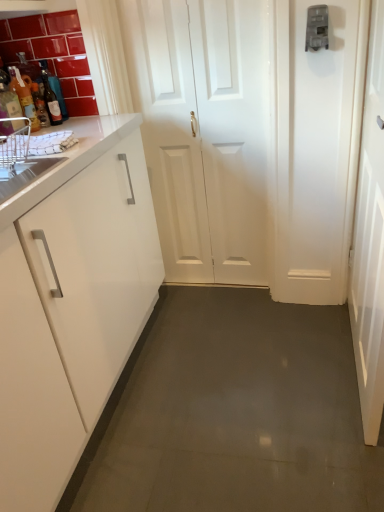
Question: In terms of height, does white glossy door at center, acting as the 2th door starting from the right, look taller or shorter compared to white glossy sink at left?

Choices:
 (A) tall
 (B) short

Answer: (A)

Question: Is white glossy door at center, which is the 1th door in left-to-right order, wider or thinner than white glossy sink at left?

Choices:
 (A) wide
 (B) thin

Answer: (B)

Question: Which is farther from the matte glass bottle at left, the 1th bottle viewed from the right?

Choices:
 (A) translucent glass bottle at left, the 3th bottle from the right
 (B) white glossy door at center, acting as the 2th door starting from the right
 (C) white glossy sink at left
 (D) white glossy door at right, the second door from the left
 (E) translucent glass bottle at left, the second bottle viewed from the left

Answer: (D)

Question: Which of these objects is positioned closest to the matte glass bottle at left, which ranks as the third bottle in left-to-right order?

Choices:
 (A) white glossy door at right, the second door from the left
 (B) translucent glass bottle at left, marked as the second bottle in a right-to-left arrangement
 (C) translucent glass bottle at left, arranged as the first bottle when viewed from the left
 (D) white glossy door at center, acting as the 2th door starting from the right
 (E) white glossy sink at left

Answer: (C)